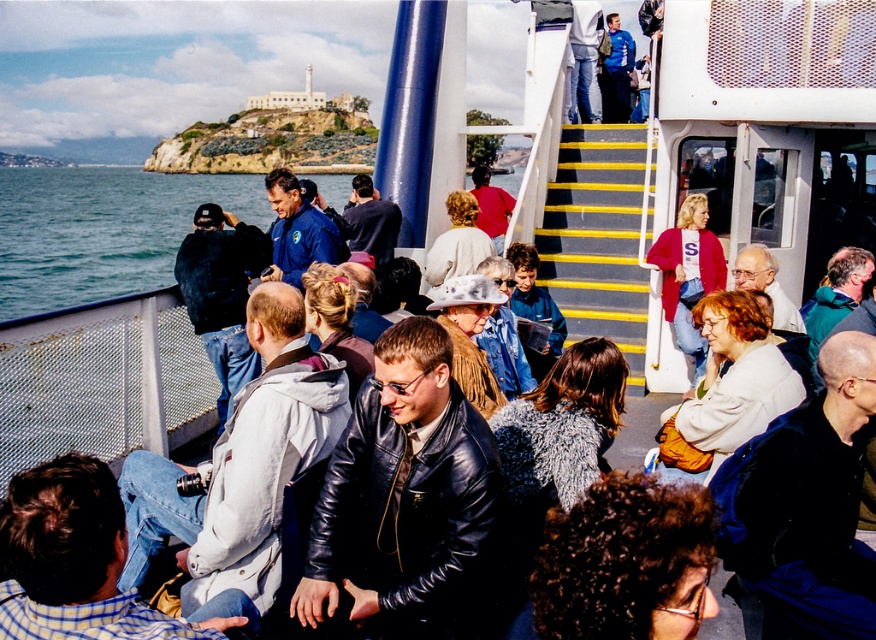
Is point (680, 516) positioned behind point (691, 397)?

No, it is in front of (691, 397).

Can you confirm if dark curly hair at center is positioned to the left of white fuzzy jacket at center?

Indeed, dark curly hair at center is positioned on the left side of white fuzzy jacket at center.

Locate an element on the screen. Image resolution: width=876 pixels, height=640 pixels. dark curly hair at center is located at coordinates (626, 561).

Is point (684, 339) closer to viewer compared to point (442, 268)?

Yes, point (684, 339) is closer to viewer.

Who is more forward, (662, 259) or (458, 209)?

Positioned in front is point (662, 259).

Where is `red sweater at upper right`? The image size is (876, 640). red sweater at upper right is located at coordinates (689, 273).

How far apart are dark blue leather jacket at lower right and dark curly hair at center?

A distance of 7.72 meters exists between dark blue leather jacket at lower right and dark curly hair at center.

Who is more distant from viewer, (x=742, y=540) or (x=592, y=609)?

The point (x=742, y=540) is more distant.

At what (x,y) coordinates should I click in order to perform the action: click on dark blue leather jacket at lower right. Please return your answer as a coordinate pair (x, y). Looking at the image, I should click on (804, 502).